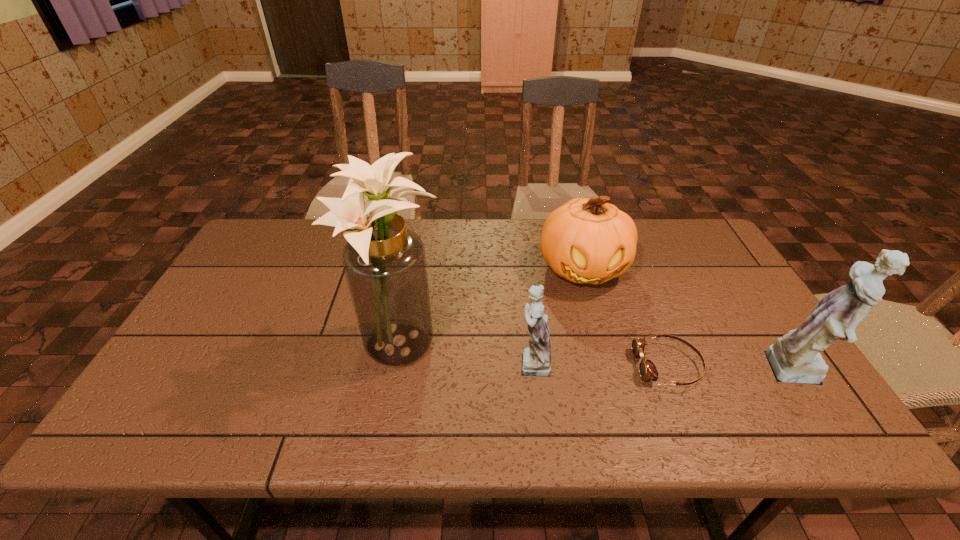
Where is `vacant area between the shorter figurine and the farthest object`? Image resolution: width=960 pixels, height=540 pixels. vacant area between the shorter figurine and the farthest object is located at coordinates (558, 315).

Image resolution: width=960 pixels, height=540 pixels. Identify the location of free space between the rightmost object and the flower arrangement. (601, 361).

Locate an element on the screen. The height and width of the screenshot is (540, 960). blank region between the right figurine and the left figurine is located at coordinates (666, 368).

At what (x,y) coordinates should I click in order to perform the action: click on object that ranks as the fourth closest to the shortest object. Please return your answer as a coordinate pair (x, y). Looking at the image, I should click on (384, 262).

Where is `object that can be found as the second closest to the shortest object`? object that can be found as the second closest to the shortest object is located at coordinates (795, 358).